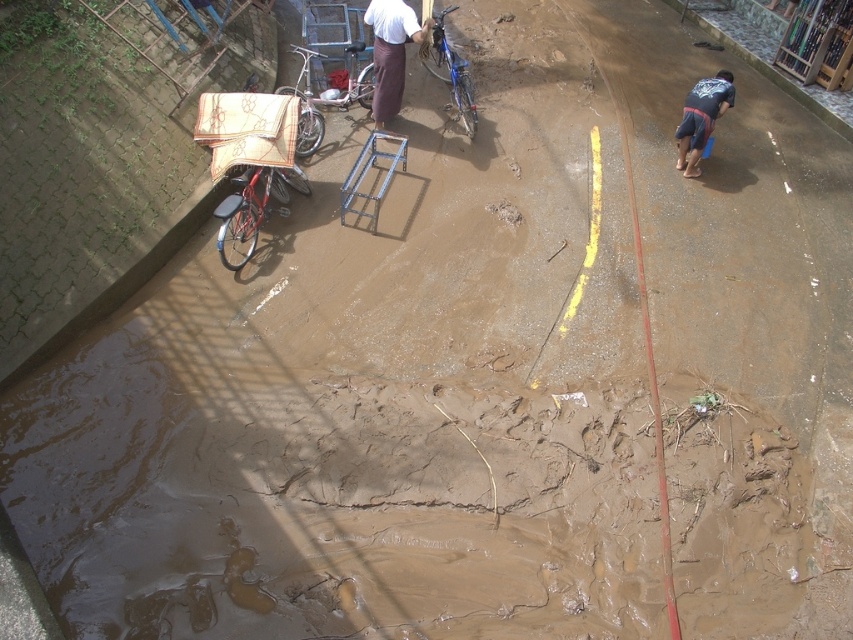
The height and width of the screenshot is (640, 853). I want to click on brushed metal bicycle at upper left, so click(322, 100).

Is brushed metal bicycle at upper left to the left of blue metallic bicycle at center from the viewer's perspective?

Indeed, brushed metal bicycle at upper left is positioned on the left side of blue metallic bicycle at center.

You are a GUI agent. You are given a task and a screenshot of the screen. Output one action in this format:
    pyautogui.click(x=<x>, y=<y>)
    Task: Click on the brushed metal bicycle at upper left
    The height and width of the screenshot is (640, 853).
    Given the screenshot: What is the action you would take?
    pyautogui.click(x=322, y=100)

You are a GUI agent. You are given a task and a screenshot of the screen. Output one action in this format:
    pyautogui.click(x=<x>, y=<y>)
    Task: Click on the brushed metal bicycle at upper left
    The height and width of the screenshot is (640, 853).
    Given the screenshot: What is the action you would take?
    pyautogui.click(x=322, y=100)

Is brushed metal bicycle at upper left positioned behind dark blue fabric at lower right?

Yes, brushed metal bicycle at upper left is behind dark blue fabric at lower right.

Looking at this image, measure the distance between brushed metal bicycle at upper left and camera.

They are 9.06 meters apart.

Based on the photo, who is more distant from viewer, (306,132) or (712,106)?

The point (306,132) is more distant.

You are a GUI agent. You are given a task and a screenshot of the screen. Output one action in this format:
    pyautogui.click(x=<x>, y=<y>)
    Task: Click on the brushed metal bicycle at upper left
    Image resolution: width=853 pixels, height=640 pixels.
    Given the screenshot: What is the action you would take?
    pyautogui.click(x=322, y=100)

Does dark blue fabric at lower right have a lesser height compared to blue metallic bicycle at center?

Yes.

Can you confirm if dark blue fabric at lower right is positioned to the right of blue metallic bicycle at center?

Indeed, dark blue fabric at lower right is positioned on the right side of blue metallic bicycle at center.

Image resolution: width=853 pixels, height=640 pixels. In order to click on dark blue fabric at lower right in this screenshot , I will do `click(701, 118)`.

Where is `dark blue fabric at lower right`? The height and width of the screenshot is (640, 853). dark blue fabric at lower right is located at coordinates (701, 118).